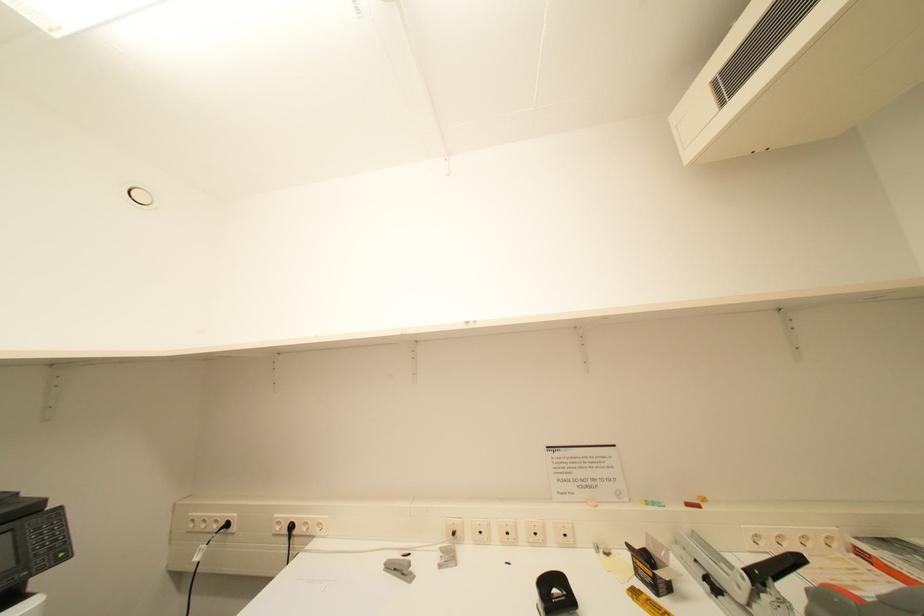
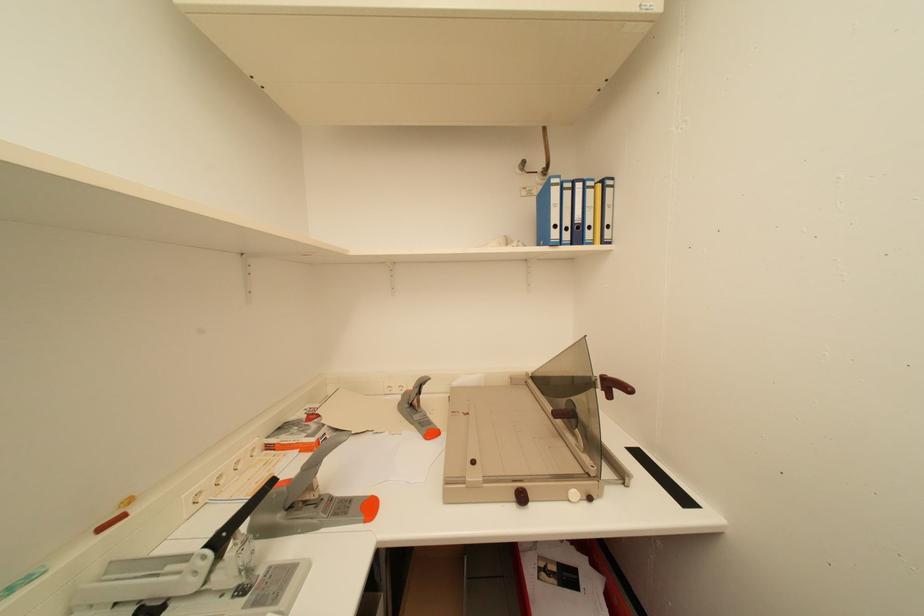
Question: Based on the continuous images, in which direction is the camera rotating? Reply with the corresponding letter.

Choices:
 (A) Left
 (B) Right
 (C) Up
 (D) Down

Answer: (B)